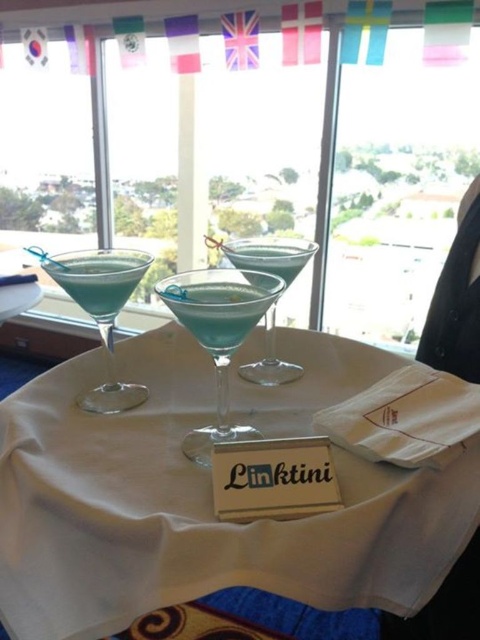
Question: Is matte glass cocktail at center smaller than translucent glass cocktail at left?

Choices:
 (A) yes
 (B) no

Answer: (B)

Question: Which point is farther to the camera?

Choices:
 (A) translucent glass cocktail at left
 (B) white cloth at center

Answer: (A)

Question: Can you confirm if blue glass at center is smaller than blue glass martini at center?

Choices:
 (A) no
 (B) yes

Answer: (B)

Question: Does translucent glass cocktail at left have a larger size compared to blue glass martini at center?

Choices:
 (A) yes
 (B) no

Answer: (B)

Question: Which of these objects is positioned farthest from the blue glass at center?

Choices:
 (A) matte blue glass at left
 (B) blue glass martini at center
 (C) white cloth at center
 (D) translucent glass cocktail at left

Answer: (C)

Question: Which point is farther to the camera?

Choices:
 (A) white cloth at center
 (B) matte blue glass at left
 (C) blue glass at center

Answer: (B)